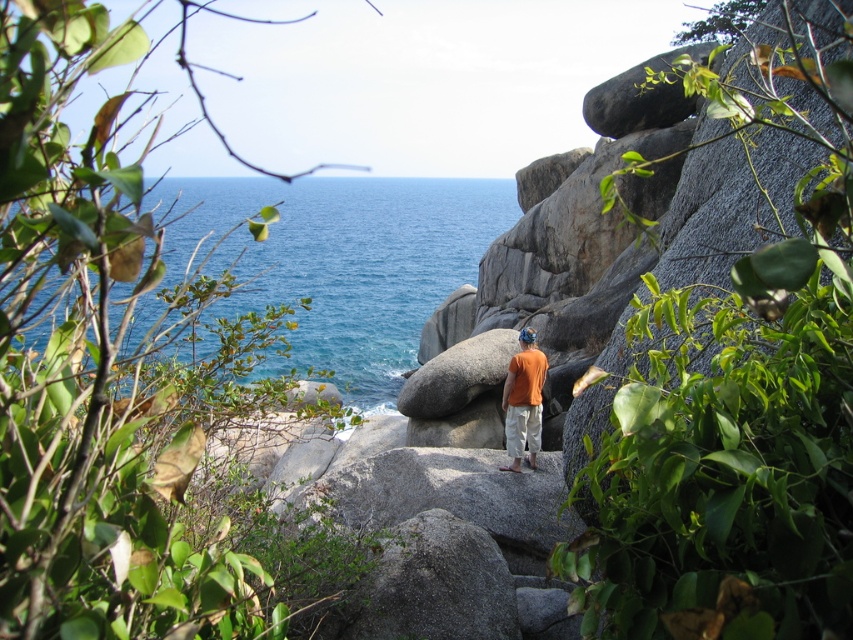
Between point (347, 179) and point (518, 380), which one is positioned behind?

The point (347, 179) is behind.

At what (x,y) coordinates should I click in order to perform the action: click on blue water at center. Please return your answer as a coordinate pair (x, y). The image size is (853, 640). Looking at the image, I should click on (341, 262).

You are a GUI agent. You are given a task and a screenshot of the screen. Output one action in this format:
    pyautogui.click(x=<x>, y=<y>)
    Task: Click on the blue water at center
    The height and width of the screenshot is (640, 853).
    Given the screenshot: What is the action you would take?
    pyautogui.click(x=341, y=262)